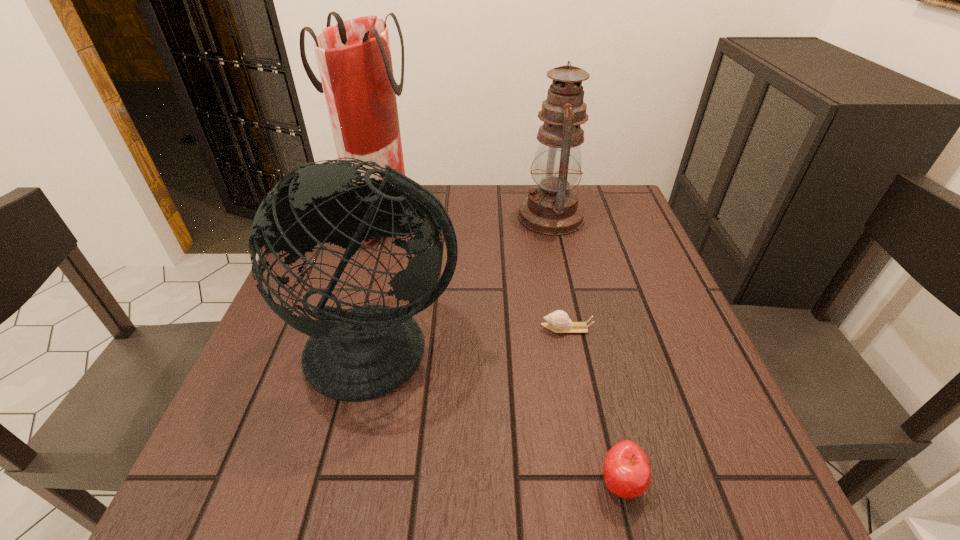
I want to click on object present at the far right corner, so click(552, 208).

Image resolution: width=960 pixels, height=540 pixels. I want to click on free space at the far edge of the desktop, so click(432, 188).

Where is `free space at the near edge of the desktop`? free space at the near edge of the desktop is located at coordinates (343, 486).

At what (x,y) coordinates should I click in order to perform the action: click on vacant area at the left edge. Please return your answer as a coordinate pair (x, y). The image size is (960, 540). Looking at the image, I should click on (309, 265).

Find the location of `free space at the right edge of the desktop`. free space at the right edge of the desktop is located at coordinates (644, 302).

The height and width of the screenshot is (540, 960). Find the location of `vacant space at the far right corner of the desktop`. vacant space at the far right corner of the desktop is located at coordinates tap(601, 230).

Where is `blank space at the near right corner of the desktop`? The width and height of the screenshot is (960, 540). blank space at the near right corner of the desktop is located at coordinates (781, 517).

Locate an element on the screen. The height and width of the screenshot is (540, 960). vacant space that's between the nearest object and the oil lamp is located at coordinates (586, 350).

Find the location of `blank region between the tallest object and the oil lamp`. blank region between the tallest object and the oil lamp is located at coordinates (467, 215).

You are a GUI agent. You are given a task and a screenshot of the screen. Output one action in this format:
    pyautogui.click(x=<x>, y=<y>)
    Task: Click on the vacant point located between the oil lamp and the nearest object
    This screenshot has height=540, width=960.
    Given the screenshot: What is the action you would take?
    pyautogui.click(x=586, y=350)